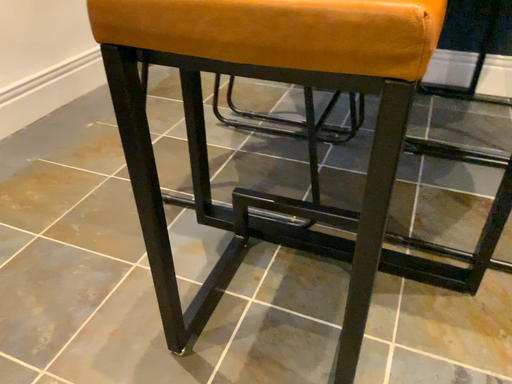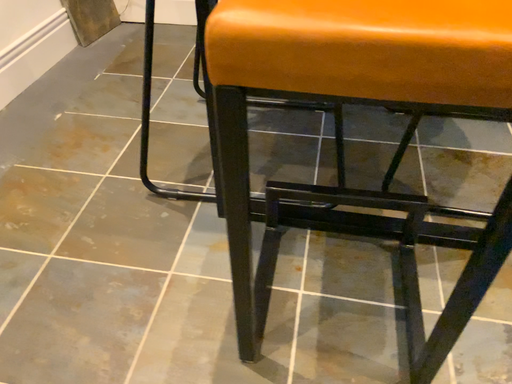
Question: Which way did the camera rotate in the video?

Choices:
 (A) rotated left
 (B) rotated right

Answer: (B)